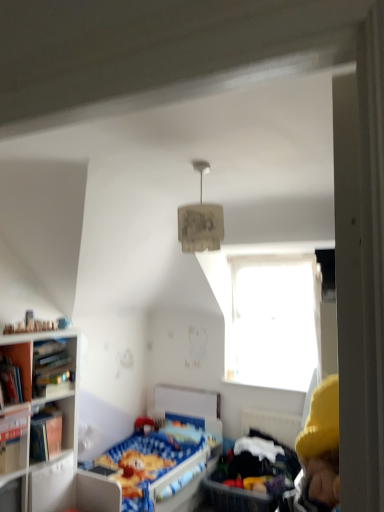
What are the coordinates of `vacant space in transparent glass window at upper center (from a real-world perspective)` in the screenshot? It's located at (270, 380).